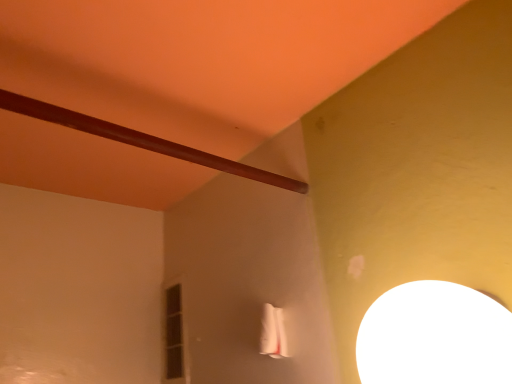
Question: Is matte glass window at center left to the left of brown polished wood beam at upper left from the viewer's perspective?

Choices:
 (A) yes
 (B) no

Answer: (A)

Question: Is matte glass window at center left closer to the viewer compared to brown polished wood beam at upper left?

Choices:
 (A) yes
 (B) no

Answer: (B)

Question: Is brown polished wood beam at upper left completely or partially inside matte glass window at center left?

Choices:
 (A) no
 (B) yes

Answer: (A)

Question: From the image's perspective, is matte glass window at center left over brown polished wood beam at upper left?

Choices:
 (A) yes
 (B) no

Answer: (B)

Question: Is matte glass window at center left wider than brown polished wood beam at upper left?

Choices:
 (A) no
 (B) yes

Answer: (A)

Question: Considering the relative positions of matte glass window at center left and brown polished wood beam at upper left in the image provided, is matte glass window at center left behind brown polished wood beam at upper left?

Choices:
 (A) no
 (B) yes

Answer: (B)

Question: From a real-world perspective, is brown polished wood beam at upper left over white glossy lampshade at upper right?

Choices:
 (A) yes
 (B) no

Answer: (A)

Question: Is brown polished wood beam at upper left turned away from white glossy lampshade at upper right?

Choices:
 (A) no
 (B) yes

Answer: (A)

Question: Is brown polished wood beam at upper left surrounding white glossy lampshade at upper right?

Choices:
 (A) no
 (B) yes

Answer: (A)

Question: Considering the relative sizes of brown polished wood beam at upper left and white glossy lampshade at upper right in the image provided, is brown polished wood beam at upper left thinner than white glossy lampshade at upper right?

Choices:
 (A) no
 (B) yes

Answer: (B)

Question: Can you confirm if brown polished wood beam at upper left is positioned to the right of white glossy lampshade at upper right?

Choices:
 (A) yes
 (B) no

Answer: (B)

Question: Can you confirm if brown polished wood beam at upper left is shorter than white glossy lampshade at upper right?

Choices:
 (A) yes
 (B) no

Answer: (A)

Question: Does brown polished wood beam at upper left have a greater width compared to matte glass window at center left?

Choices:
 (A) no
 (B) yes

Answer: (B)